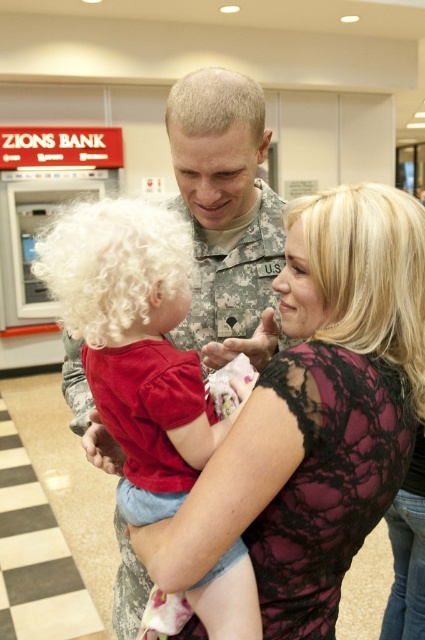
You are a photographer setting up for a family portrait. You need to ensure that the soft white hair at center and the blonde lace wig at upper right are visible in the frame. Given their distance apart, what is the minimum width of the camera frame required to capture both objects simultaneously?

The minimum width of the camera frame required to capture both the soft white hair at center and the blonde lace wig at upper right is at least 28.94 centimeters, as they are 28.94 centimeters apart.

You are a photographer setting up a shoot in a bank. You have two props to place on a shelf behind the camera. The shelf is 1 meter wide. You need to know which prop is wider to ensure proper placement. Which object is wider between the soft white hair at center and the blonde lace wig at upper right?

The soft white hair at center is wider than the blonde lace wig at upper right, so it should be placed first to ensure it fits on the shelf.